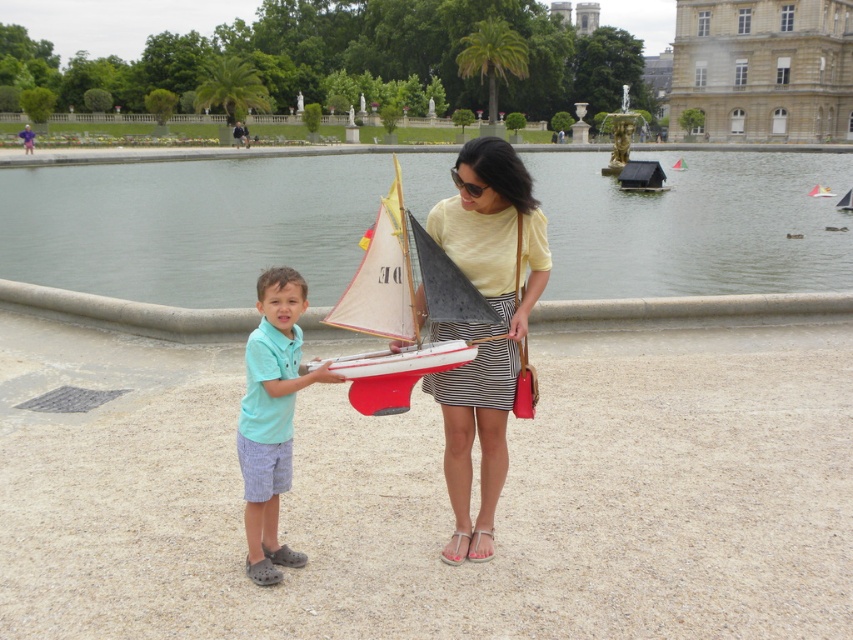
Is matte yellow shirt at center below white matte sailboat at center?

Yes.

Does point (486, 371) lie behind point (463, 284)?

Yes, point (486, 371) is farther from viewer.

At what (x,y) coordinates should I click in order to perform the action: click on matte yellow shirt at center. Please return your answer as a coordinate pair (x, y). This screenshot has height=640, width=853. Looking at the image, I should click on (485, 324).

Which is more to the right, clear water at lake center or matte yellow shirt at center?

From the viewer's perspective, clear water at lake center appears more on the right side.

Can you confirm if clear water at lake center is taller than matte yellow shirt at center?

Yes.

Which is in front, point (96, 209) or point (524, 301)?

Point (524, 301) is more forward.

Identify the location of clear water at lake center. (189, 225).

Is clear water at lake center smaller than brown stone building at upper right?

Incorrect, clear water at lake center is not smaller in size than brown stone building at upper right.

Is point (15, 268) positioned before point (817, 3)?

Yes, point (15, 268) is closer to viewer.

This screenshot has width=853, height=640. What are the coordinates of `clear water at lake center` in the screenshot? It's located at (189, 225).